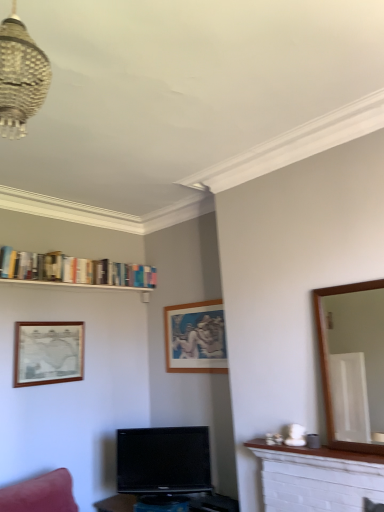
At what (x,y) coordinates should I click in order to perform the action: click on empty space that is ontop of white marble mantle at lower right (from a real-world perspective). Please return your answer as a coordinate pair (x, y). This screenshot has height=512, width=384. Looking at the image, I should click on pyautogui.click(x=334, y=445).